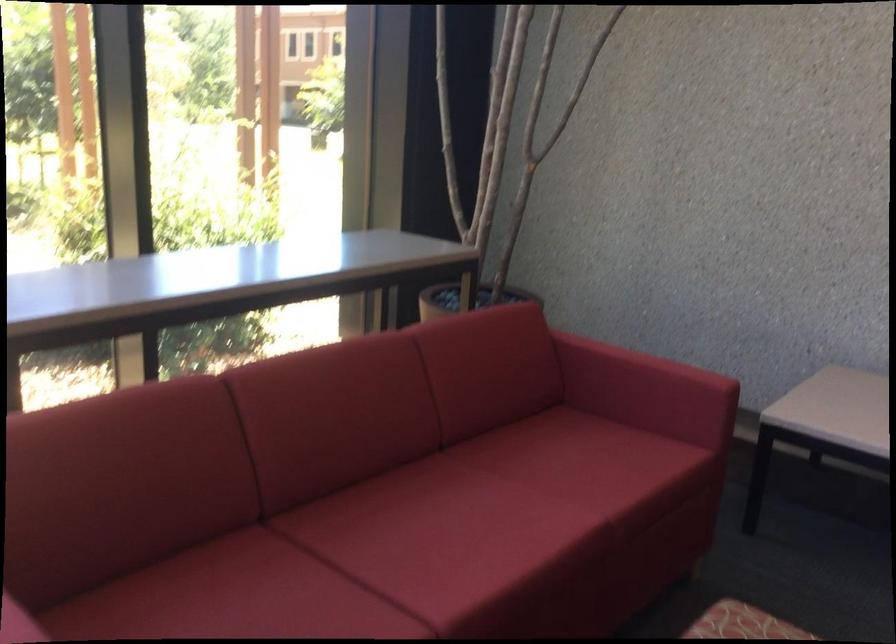
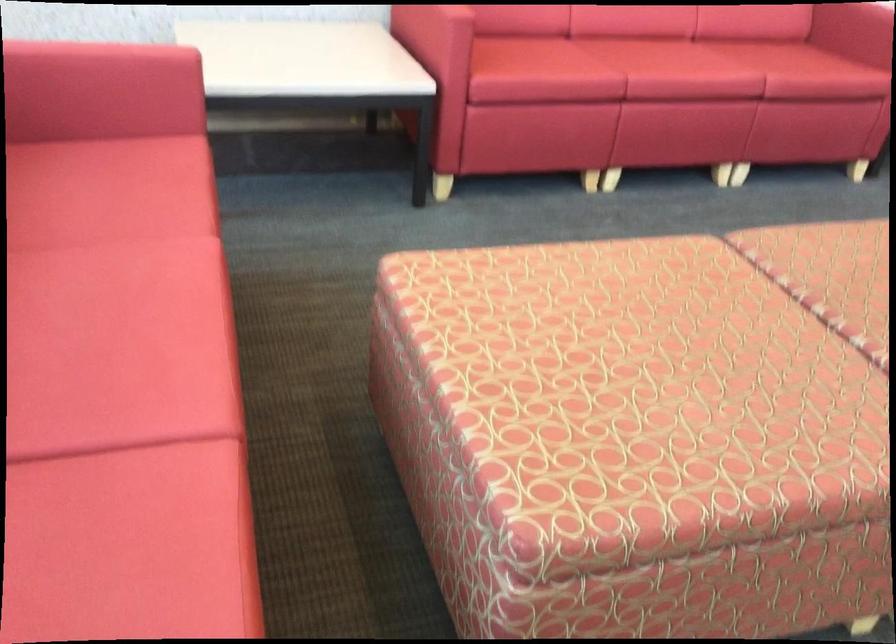
First-person continuous shooting, in which direction is the camera rotating?

The rotation direction of the camera is right-down.